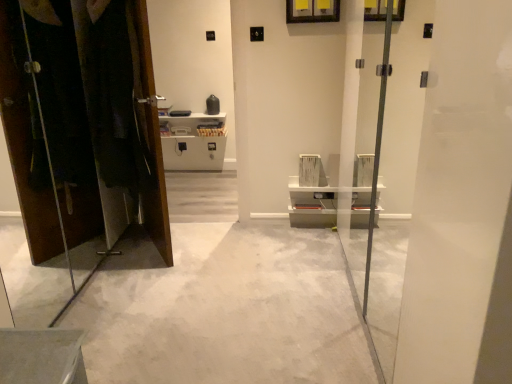
Question: Considering the relative sizes of transparent glass screen door at center and white concrete floor at center in the image provided, is transparent glass screen door at center wider than white concrete floor at center?

Choices:
 (A) yes
 (B) no

Answer: (B)

Question: Can you confirm if transparent glass screen door at center is positioned to the left of white concrete floor at center?

Choices:
 (A) yes
 (B) no

Answer: (B)

Question: From the image's perspective, is transparent glass screen door at center under white concrete floor at center?

Choices:
 (A) no
 (B) yes

Answer: (A)

Question: From a real-world perspective, is transparent glass screen door at center over white concrete floor at center?

Choices:
 (A) no
 (B) yes

Answer: (B)

Question: Is transparent glass screen door at center to the right of white concrete floor at center from the viewer's perspective?

Choices:
 (A) no
 (B) yes

Answer: (B)

Question: Is transparent glass screen door at center positioned far away from white concrete floor at center?

Choices:
 (A) yes
 (B) no

Answer: (B)

Question: Is matte brown dresser at left bigger than white concrete floor at center?

Choices:
 (A) yes
 (B) no

Answer: (B)

Question: Is white concrete floor at center at the back of matte brown dresser at left?

Choices:
 (A) yes
 (B) no

Answer: (B)

Question: From the image's perspective, is matte brown dresser at left over white concrete floor at center?

Choices:
 (A) no
 (B) yes

Answer: (B)

Question: Is matte brown dresser at left at the right side of white concrete floor at center?

Choices:
 (A) no
 (B) yes

Answer: (A)

Question: Can you confirm if matte brown dresser at left is positioned to the left of white concrete floor at center?

Choices:
 (A) no
 (B) yes

Answer: (B)

Question: From the image's perspective, is matte brown dresser at left under white concrete floor at center?

Choices:
 (A) yes
 (B) no

Answer: (B)

Question: Is dark fabric laundry at left far from matte brown dresser at left?

Choices:
 (A) yes
 (B) no

Answer: (B)